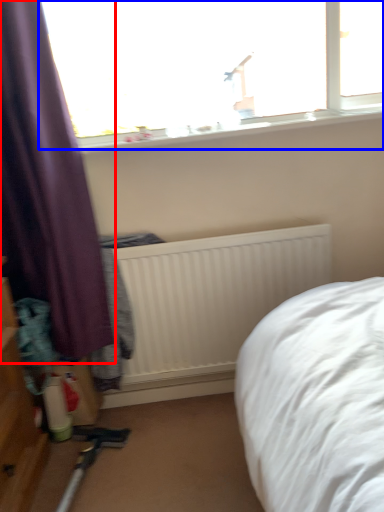
Question: Among these objects, which one is farthest to the camera, curtain (highlighted by a red box) or window (highlighted by a blue box)?

Choices:
 (A) curtain
 (B) window

Answer: (B)